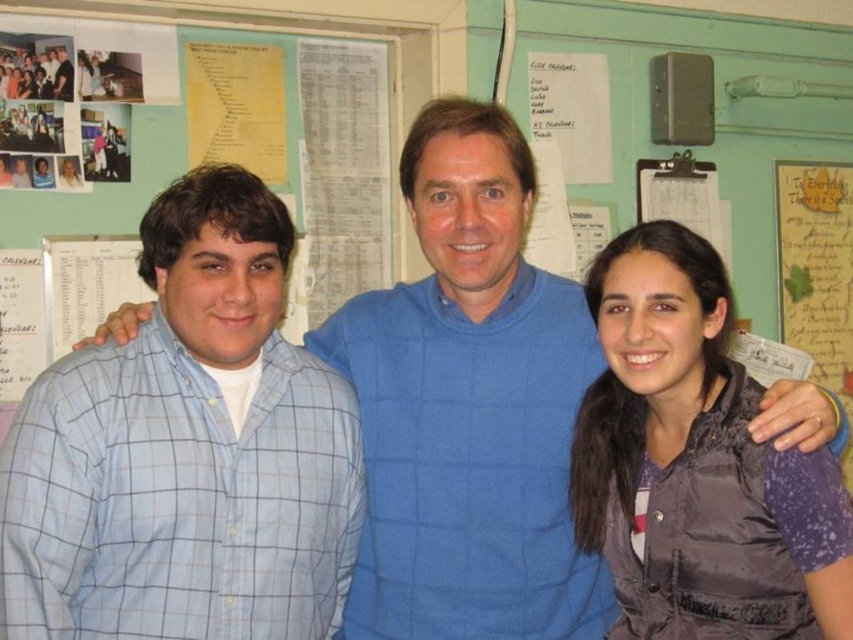
You are organizing a group photo and need to arrange the blue checkered shirt at left and the dark gray puffy vest at right based on their sizes. Which one should be placed in a position that requires a larger space?

The blue checkered shirt at left should be placed in the position requiring a larger space since it has a larger size compared to the dark gray puffy vest at right.

You are an office worker who needs to find a specific document pinned on the wall. You see the blue checkered shirt at left and the matte black shirt at upper left. Which shirt is closer to the bulletin board with the documents?

The blue checkered shirt at left is located below the matte black shirt at upper left, so the matte black shirt at upper left is closer to the bulletin board with the documents.

You are standing in the office scene and want to reach both the point at coordinates (738, 637) and the point at (67, 93). Which point should you approach first to minimize the total distance walked?

You should approach point (67, 93) first because it is farther from the viewer, so reaching it first would allow you to cover the greater distance early, potentially reducing backtracking. However, without knowing your starting position, the optimal path isn,t certain. But based on proximity to the viewer, starting with the farther point might be more efficient.